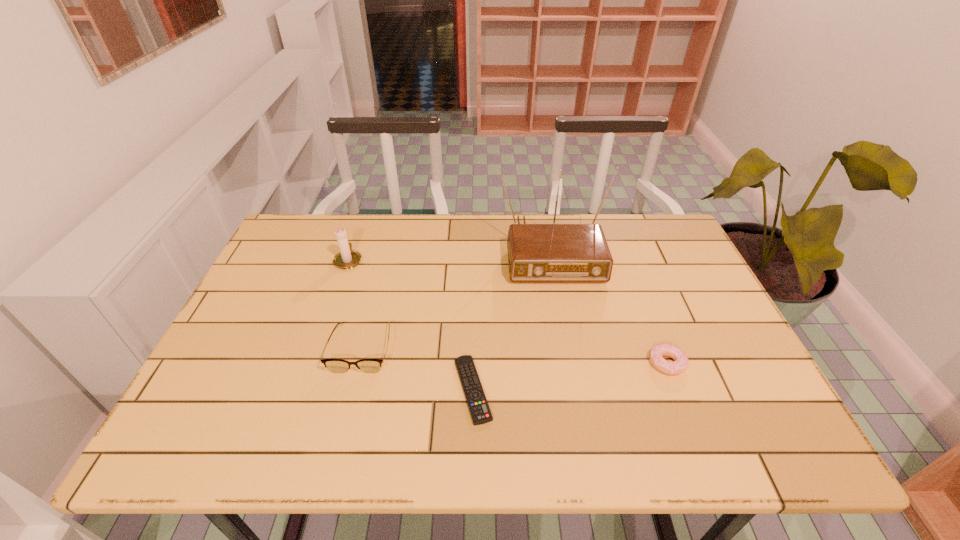
Where is `vacant space that satisfies the following two spatial constraints: 1. on the front panel of the rightmost object; 2. on the left side of the tallest object`? This screenshot has height=540, width=960. vacant space that satisfies the following two spatial constraints: 1. on the front panel of the rightmost object; 2. on the left side of the tallest object is located at coordinates (571, 363).

Where is `vacant space that satisfies the following two spatial constraints: 1. on the back side of the second shortest object; 2. on the left side of the shortest object`? The width and height of the screenshot is (960, 540). vacant space that satisfies the following two spatial constraints: 1. on the back side of the second shortest object; 2. on the left side of the shortest object is located at coordinates (473, 363).

You are a GUI agent. You are given a task and a screenshot of the screen. Output one action in this format:
    pyautogui.click(x=<x>, y=<y>)
    Task: Click on the free location that satisfies the following two spatial constraints: 1. on the face of the remote control; 2. on the right side of the third shortest object
    
    Given the screenshot: What is the action you would take?
    pyautogui.click(x=351, y=389)